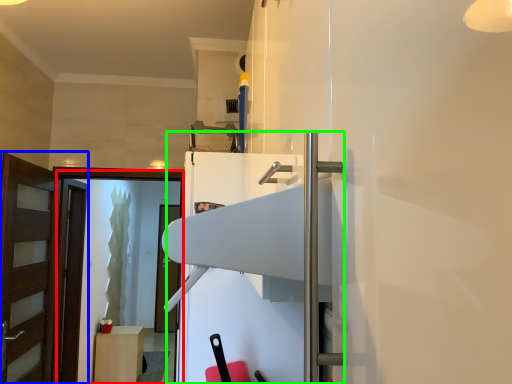
Question: Which object is the closest to the screen door (highlighted by a red box)? Choose among these: door (highlighted by a blue box) or fridge (highlighted by a green box).

Choices:
 (A) door
 (B) fridge

Answer: (A)